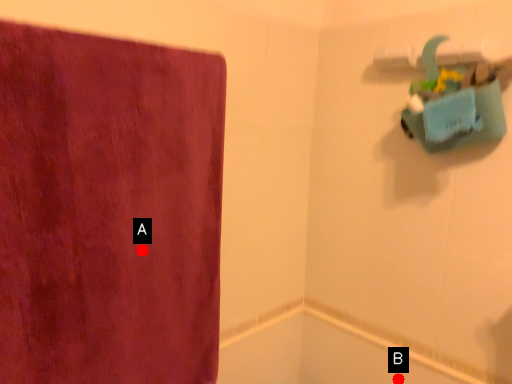
Question: Two points are circled on the image, labeled by A and B beside each circle. Which of the following is the closest to the observer?

Choices:
 (A) A is closer
 (B) B is closer

Answer: (A)